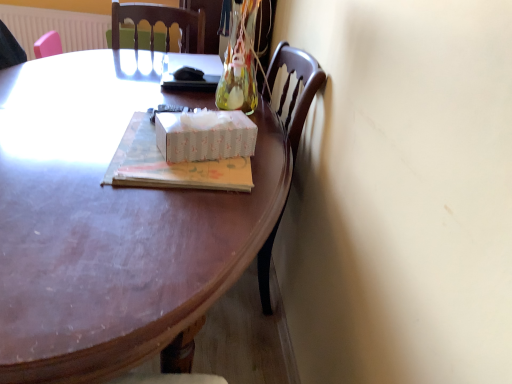
Identify the location of free spot to the right of white paper tissue box at center. The height and width of the screenshot is (384, 512). (270, 159).